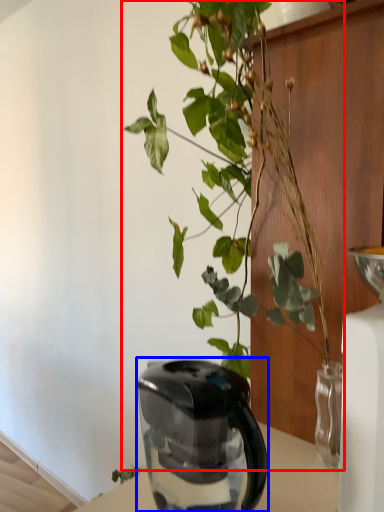
Question: Which object appears closest to the camera in this image, houseplant (highlighted by a red box) or kettle (highlighted by a blue box)?

Choices:
 (A) houseplant
 (B) kettle

Answer: (A)